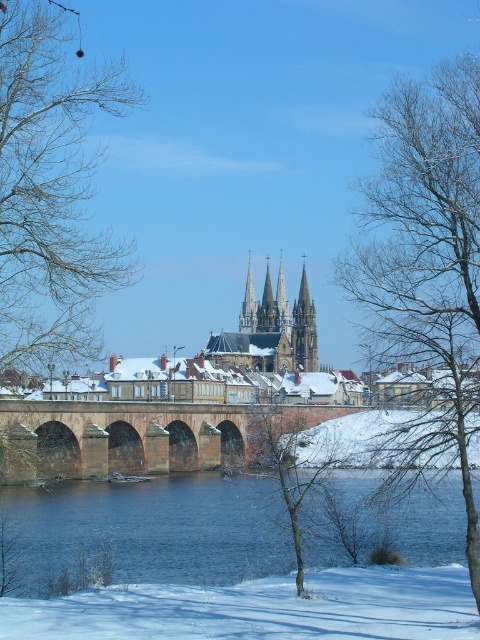
Question: Is blue water at center to the left of smooth gray stone spire at center from the viewer's perspective?

Choices:
 (A) no
 (B) yes

Answer: (B)

Question: Which of the following is the closest to the observer?

Choices:
 (A) bare branches at lower center
 (B) blue water at center
 (C) bare branches at left

Answer: (C)

Question: Estimate the real-world distances between objects in this image. Which object is closer to the white powdery snow at lower center?

Choices:
 (A) smooth gray stone spire at center
 (B) bare branches at left
 (C) brown stone bridge at center

Answer: (B)

Question: Does bare branches at center come in front of white powdery snow at lower center?

Choices:
 (A) no
 (B) yes

Answer: (A)

Question: Among these objects, which one is farthest from the camera?

Choices:
 (A) smooth gray spire at center
 (B) bare branches at lower center

Answer: (A)

Question: Does white powdery snow at lower center have a larger size compared to bare branches at lower center?

Choices:
 (A) no
 (B) yes

Answer: (A)